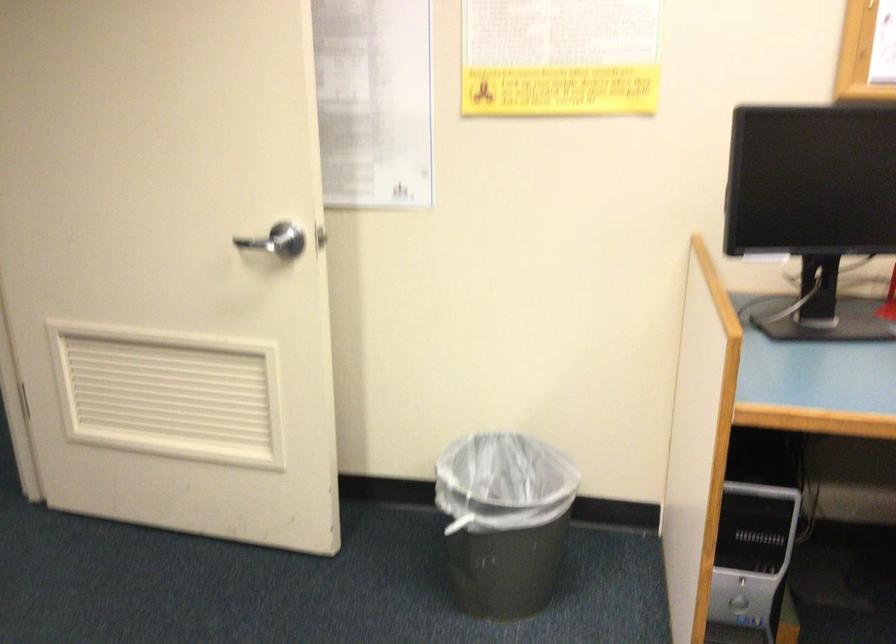
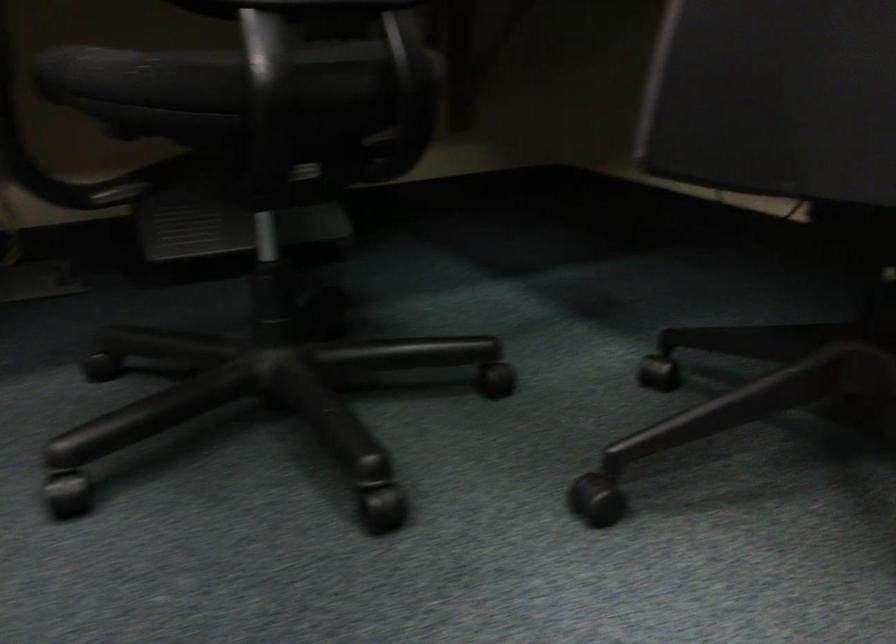
Question: The camera is either moving clockwise (left) or counter-clockwise (right) around the object. The first image is from the beginning of the video and the second image is from the end. Is the camera moving left or right when shooting the video?

Choices:
 (A) Left
 (B) Right

Answer: (A)